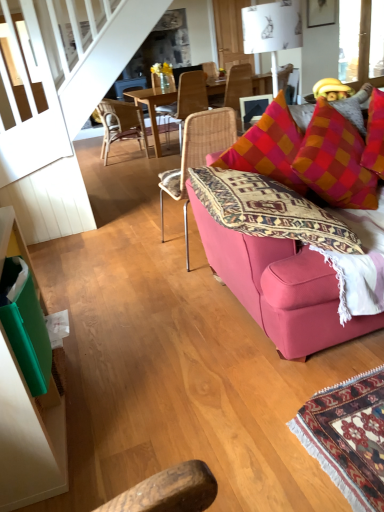
Question: From a real-world perspective, relative to wooden textured chair at center, which appears as the fourth chair when viewed from the front, is woven rattan chair at center, which appears as the 2th chair when viewed from the front, vertically above or below?

Choices:
 (A) above
 (B) below

Answer: (B)

Question: Is woven rattan chair at center, which is counted as the 3th chair, starting from the back, taller or shorter than wooden textured chair at center, which appears as the fourth chair when viewed from the front?

Choices:
 (A) tall
 (B) short

Answer: (A)

Question: Considering the real-world distances, which object is farthest from the wooden textured chair at center, which appears as the fourth chair when viewed from the front?

Choices:
 (A) pink fabric couch at right
 (B) orange-red checkered throw pillow at upper right
 (C) white paper lampshade at upper center
 (D) woven rattan chair at center, which is counted as the 3th chair, starting from the back
 (E) wooden chair at center, positioned as the third chair in front-to-back order

Answer: (A)

Question: Based on their relative distances, which object is nearer to the wooden textured chair at center, which appears as the fourth chair when viewed from the front?

Choices:
 (A) woven rattan chair at center, the 4th chair viewed from the back
 (B) pink fabric couch at right
 (C) wooden chair at center, which ranks as the 2th chair in back-to-front order
 (D) orange-red checkered throw pillow at upper right
 (E) white paper lampshade at upper center

Answer: (C)